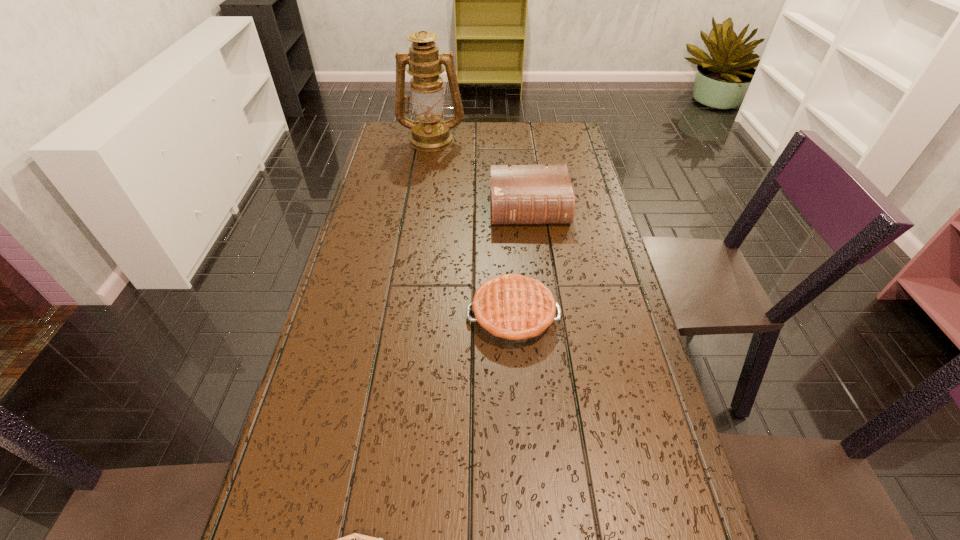
Locate an element on the screen. vacant point located between the third shortest object and the second shortest object is located at coordinates (521, 262).

The height and width of the screenshot is (540, 960). I want to click on object that is the closest to the second nearest object, so click(520, 194).

Locate which object ranks second in proximity to the Bible. Please provide its 2D coordinates. Your answer should be formatted as a tuple, i.e. [(x, y)], where the tuple contains the x and y coordinates of a point satisfying the conditions above.

[(430, 133)]